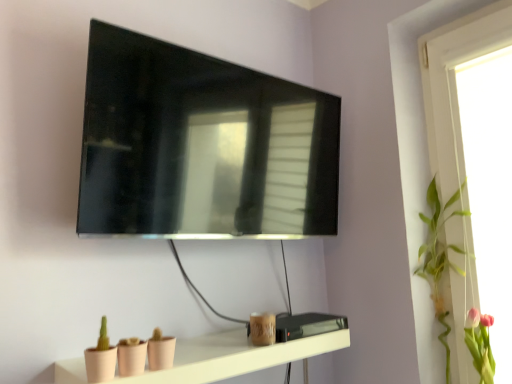
This screenshot has width=512, height=384. I want to click on matte black tv at upper center, so click(x=201, y=146).

The width and height of the screenshot is (512, 384). I want to click on matte pink shelf at lower center, so click(x=234, y=356).

Measure the distance between point (306,356) and camera.

Point (306,356) and camera are 4.02 feet apart from each other.

Identify the location of green leafy plant at upper right. This screenshot has height=384, width=512. (439, 256).

Locate an element on the screen. This screenshot has height=384, width=512. matte black tv at upper center is located at coordinates (201, 146).

Can you confirm if matte pink shelf at lower center is shorter than green leafy plant at upper right?

Indeed, matte pink shelf at lower center has a lesser height compared to green leafy plant at upper right.

Is matte pink shelf at lower center closer to the viewer compared to green leafy plant at upper right?

Yes, matte pink shelf at lower center is in front of green leafy plant at upper right.

Is matte pink shelf at lower center looking in the opposite direction of green leafy plant at upper right?

That's not correct — matte pink shelf at lower center is not looking away from green leafy plant at upper right.

The width and height of the screenshot is (512, 384). What are the coordinates of `shelf in front of the green leafy plant at upper right` in the screenshot? It's located at (234, 356).

Which point is more forward, (424, 272) or (479, 322)?

The point (479, 322) is closer to the camera.

Relative to pink silk flower at upper right, is green leafy plant at upper right in front or behind?

Clearly, green leafy plant at upper right is behind pink silk flower at upper right.

Image resolution: width=512 pixels, height=384 pixels. Identify the location of floral arrangement on the right of green leafy plant at upper right. (480, 344).

Is green leafy plant at upper right positioned with its back to pink silk flower at upper right?

That's not correct — green leafy plant at upper right is not looking away from pink silk flower at upper right.

Can you tell me how much pink silk flower at upper right and green leafy plant at upper right differ in facing direction?

13.9 degrees.

Is point (481, 374) positioned in front of point (443, 342)?

Yes, it is in front of point (443, 342).

Considering their positions, is pink silk flower at upper right located in front of or behind green leafy plant at upper right?

Visually, pink silk flower at upper right is located in front of green leafy plant at upper right.

Considering the sizes of pink silk flower at upper right and green leafy plant at upper right in the image, is pink silk flower at upper right taller or shorter than green leafy plant at upper right?

pink silk flower at upper right is shorter than green leafy plant at upper right.

Who is taller, matte pink shelf at lower center or pink silk flower at upper right?

Standing taller between the two is pink silk flower at upper right.

Where is `floral arrangement below the matte pink shelf at lower center (from the image's perspective)`? Image resolution: width=512 pixels, height=384 pixels. floral arrangement below the matte pink shelf at lower center (from the image's perspective) is located at coordinates (480, 344).

Could you tell me if matte pink shelf at lower center is facing pink silk flower at upper right?

No, matte pink shelf at lower center is not turned towards pink silk flower at upper right.

Does matte pink shelf at lower center touch pink silk flower at upper right?

No, matte pink shelf at lower center is not next to pink silk flower at upper right.

Considering the sizes of objects matte pink shelf at lower center and matte black tv at upper center in the image provided, who is taller, matte pink shelf at lower center or matte black tv at upper center?

Standing taller between the two is matte black tv at upper center.

From the image's perspective, which one is positioned lower, matte pink shelf at lower center or matte black tv at upper center?

matte pink shelf at lower center appears lower in the image.

Which of these two, matte pink shelf at lower center or matte black tv at upper center, is smaller?

matte pink shelf at lower center is smaller.

Based on the photo, how different are the orientations of green leafy plant at upper right and matte pink shelf at lower center in degrees?

The angular difference between green leafy plant at upper right and matte pink shelf at lower center is 100 degrees.

Would you say green leafy plant at upper right is inside or outside matte pink shelf at lower center?

green leafy plant at upper right exists outside the volume of matte pink shelf at lower center.

Considering the sizes of green leafy plant at upper right and matte pink shelf at lower center in the image, is green leafy plant at upper right wider or thinner than matte pink shelf at lower center?

Considering their sizes, green leafy plant at upper right looks slimmer than matte pink shelf at lower center.

Can you confirm if green leafy plant at upper right is taller than matte pink shelf at lower center?

Indeed, green leafy plant at upper right has a greater height compared to matte pink shelf at lower center.

Is point (116, 225) farther from viewer compared to point (178, 347)?

No, it is in front of (178, 347).

Is matte black tv at upper center facing away from matte pink shelf at lower center?

matte black tv at upper center is not turned away from matte pink shelf at lower center.

How much distance is there between matte black tv at upper center and matte pink shelf at lower center?

They are 19.07 inches apart.

The image size is (512, 384). In order to click on shelf that appears on the left of matte black tv at upper center in this screenshot , I will do `click(234, 356)`.

Identify the location of shelf below the green leafy plant at upper right (from the image's perspective). The image size is (512, 384). click(x=234, y=356).

I want to click on floral arrangement in front of the green leafy plant at upper right, so click(480, 344).

Considering their positions, is matte black tv at upper center positioned closer to green leafy plant at upper right than matte pink shelf at lower center?

matte pink shelf at lower center is closer to green leafy plant at upper right.

Looking at the image, which one is located closer to green leafy plant at upper right, pink silk flower at upper right or matte pink shelf at lower center?

Based on the image, pink silk flower at upper right appears to be nearer to green leafy plant at upper right.

Looking at this image, which object lies nearer to the anchor point pink silk flower at upper right, matte pink shelf at lower center or matte black tv at upper center?

Based on the image, matte pink shelf at lower center appears to be nearer to pink silk flower at upper right.

Estimate the real-world distances between objects in this image. Which object is closer to pink silk flower at upper right, green leafy plant at upper right or matte black tv at upper center?

green leafy plant at upper right is positioned closer to the anchor pink silk flower at upper right.

When comparing their distances from matte black tv at upper center, does pink silk flower at upper right or matte pink shelf at lower center seem further?

pink silk flower at upper right lies further to matte black tv at upper center than the other object.

Looking at this image, from the image, which object appears to be farther from matte pink shelf at lower center, matte black tv at upper center or green leafy plant at upper right?

green leafy plant at upper right lies further to matte pink shelf at lower center than the other object.

Estimate the real-world distances between objects in this image. Which object is closer to pink silk flower at upper right, green leafy plant at upper right or matte pink shelf at lower center?

The object closer to pink silk flower at upper right is green leafy plant at upper right.

From the image, which object appears to be farther from matte pink shelf at lower center, green leafy plant at upper right or pink silk flower at upper right?

pink silk flower at upper right is positioned further to the anchor matte pink shelf at lower center.

Find the location of a particular element. Image resolution: width=512 pixels, height=384 pixels. television between matte pink shelf at lower center and pink silk flower at upper right from left to right is located at coordinates (201, 146).

Find the location of a particular element. This screenshot has height=384, width=512. television located between matte pink shelf at lower center and green leafy plant at upper right in the left-right direction is located at coordinates (201, 146).

Identify the location of plant situated between matte black tv at upper center and pink silk flower at upper right from left to right. (439, 256).

Locate an element on the screen. plant located between matte pink shelf at lower center and pink silk flower at upper right in the left-right direction is located at coordinates (439, 256).